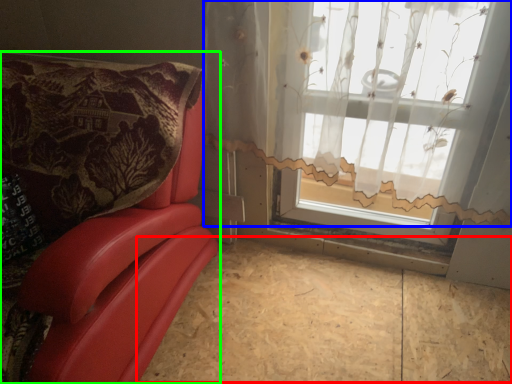
Question: Which is nearer to the plywood (highlighted by a red box)? curtain (highlighted by a blue box) or furniture (highlighted by a green box).

Choices:
 (A) curtain
 (B) furniture

Answer: (B)